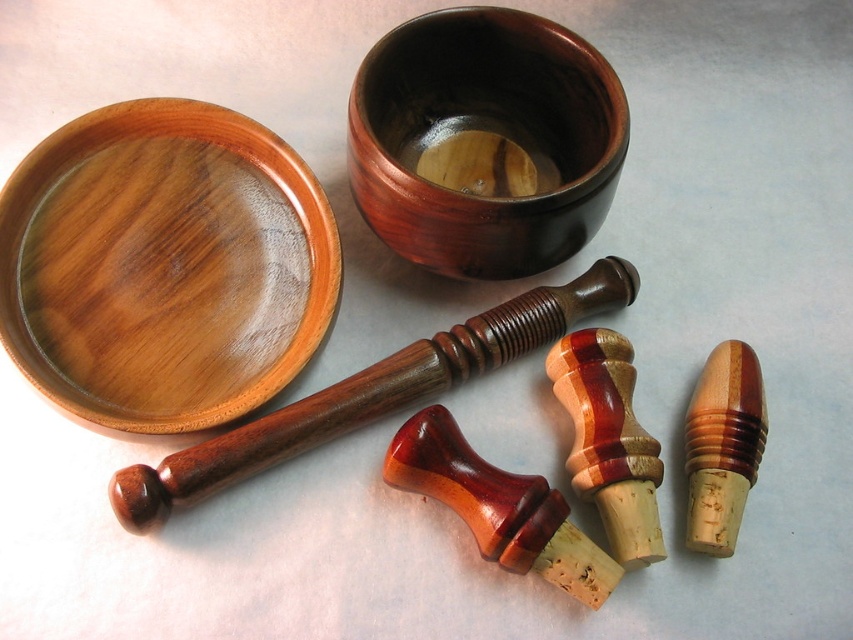
You are organizing items on a table and need to stack the wooden bowl at upper left and the dark wood bowl at center. Which bowl should you place at the bottom to ensure stability?

The wooden bowl at upper left is much taller than the dark wood bowl at center. To ensure stability when stacking, place the taller wooden bowl at upper left at the bottom since its larger base provides better support.

You are arranging items on a table and need to place a decorative item between the wooden bowl at upper left and the dark wood bowl at center. Based on their positions, which bowl should you place the decorative item in front of to ensure it is centered between them?

The wooden bowl at upper left is closer to the viewer than the dark wood bowl at center. To center the decorative item between them, place it in front of the dark wood bowl at center so it appears equidistant from both.

You are organizing items on a table and need to place both the wooden bowl at upper left and the dark wood bowl at center. Which bowl should you choose if you need a larger one to hold more items?

The wooden bowl at upper left is larger in size than the dark wood bowl at center, so you should choose the wooden bowl at upper left to hold more items.